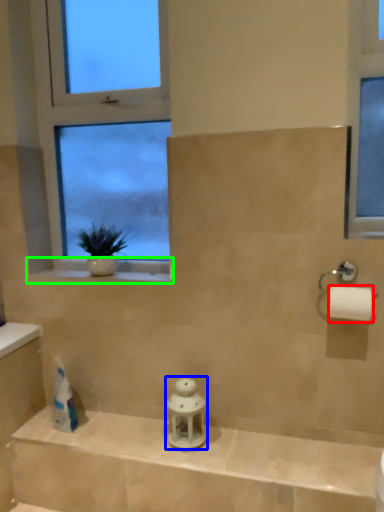
Question: Which is farther away from toilet paper (highlighted by a red box)? toiletry (highlighted by a blue box) or window sill (highlighted by a green box)?

Choices:
 (A) toiletry
 (B) window sill

Answer: (B)